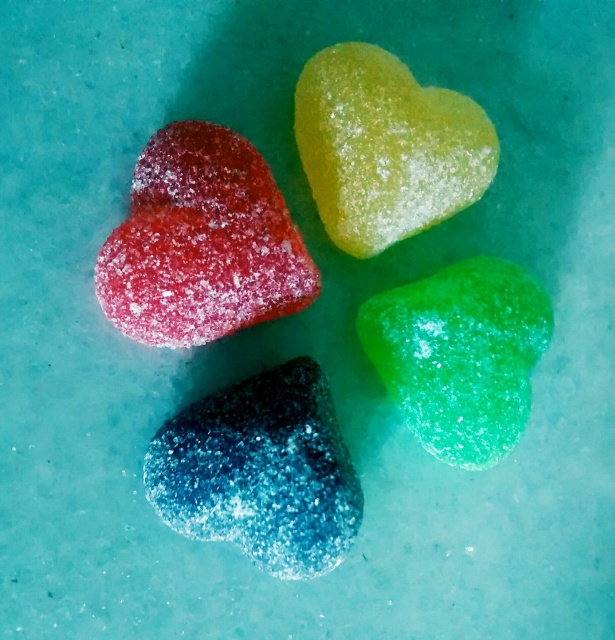
Does matte red heart at upper left appear on the left side of green glittery heart at bottom right?

Yes, matte red heart at upper left is to the left of green glittery heart at bottom right.

Who is lower down, matte red heart at upper left or green glittery heart at bottom right?

green glittery heart at bottom right

Who is more distant from viewer, (167,275) or (458,433)?

The point (458,433) is more distant.

I want to click on matte red heart at upper left, so click(200, 243).

Between blue glittery heart at bottom left and green glittery heart at bottom right, which one has more height?

green glittery heart at bottom right is taller.

Does blue glittery heart at bottom left appear on the right side of green glittery heart at bottom right?

In fact, blue glittery heart at bottom left is to the left of green glittery heart at bottom right.

The image size is (615, 640). Find the location of `blue glittery heart at bottom left`. blue glittery heart at bottom left is located at coordinates (260, 472).

Can you confirm if translucent yellow heart at upper center is taller than green glittery heart at bottom right?

No, translucent yellow heart at upper center is not taller than green glittery heart at bottom right.

Which is in front, point (383, 92) or point (363, 324)?

Positioned in front is point (383, 92).

Which is in front, point (415, 144) or point (496, 426)?

Point (415, 144) is more forward.

Locate an element on the screen. The image size is (615, 640). translucent yellow heart at upper center is located at coordinates (386, 147).